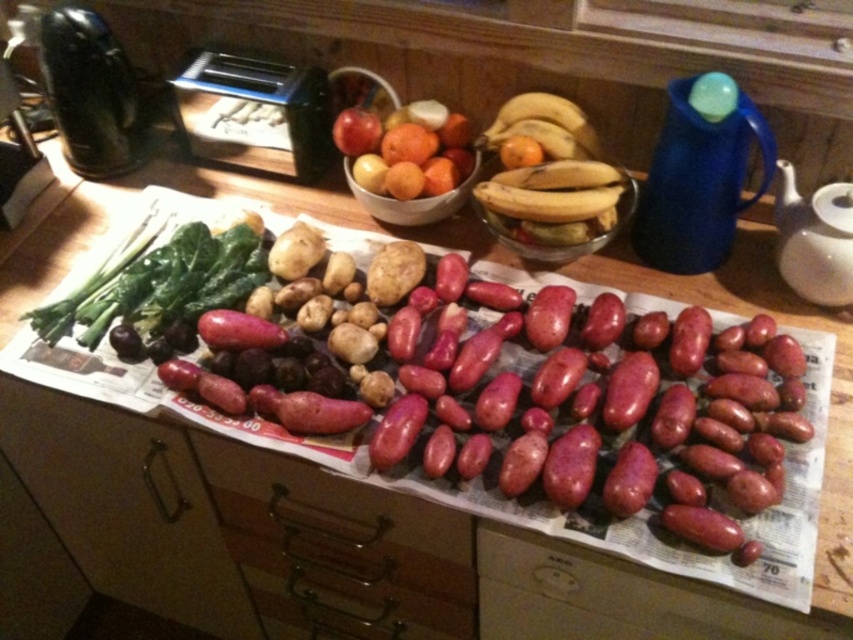
Can you confirm if green leafy at left is wider than glossy plastic bowl at center?

Yes.

Does green leafy at left have a lesser width compared to glossy plastic bowl at center?

Incorrect, green leafy at left's width is not less than glossy plastic bowl at center's.

Does point (231, 307) lie in front of point (450, 188)?

Yes, it is.

The height and width of the screenshot is (640, 853). Identify the location of green leafy at left. (161, 284).